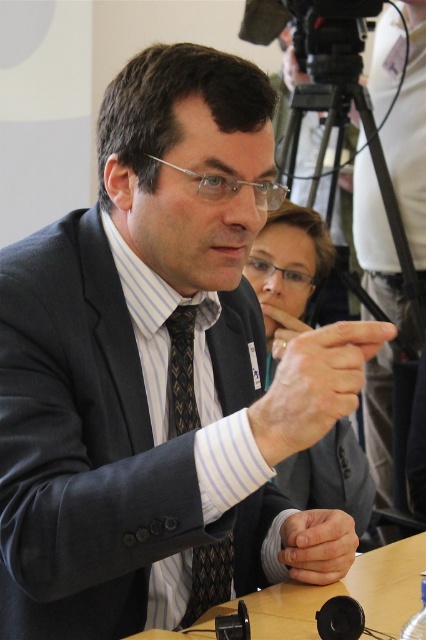
Can you confirm if dark gray suit at center is wider than white matte hand at center?

Yes, dark gray suit at center is wider than white matte hand at center.

Can you confirm if dark gray suit at center is positioned above white matte hand at center?

Actually, dark gray suit at center is below white matte hand at center.

Is point (238, 566) less distant than point (279, 392)?

No, it is not.

Identify the location of dark gray suit at center. The height and width of the screenshot is (640, 426). (115, 438).

Who is higher up, white matte hand at center or smooth skin hands at center?

white matte hand at center

Can you confirm if white matte hand at center is bigger than smooth skin hands at center?

Yes.

At what (x,y) coordinates should I click in order to perform the action: click on white matte hand at center. Please return your answer as a coordinate pair (x, y). The width and height of the screenshot is (426, 640). Looking at the image, I should click on coord(314,385).

Consider the image. Can you confirm if dark gray suit at center is bigger than matte black suit at center?

No.

Between dark gray suit at center and matte black suit at center, which one has less height?

dark gray suit at center is shorter.

Where is `dark gray suit at center`? Image resolution: width=426 pixels, height=640 pixels. dark gray suit at center is located at coordinates (115, 438).